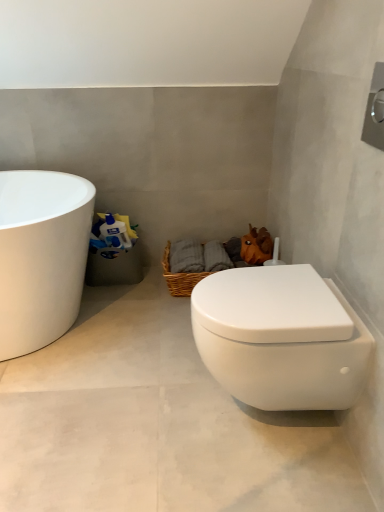
Question: Is white glossy toilet at lower right next to white matte toilet at lower right and touching it?

Choices:
 (A) yes
 (B) no

Answer: (B)

Question: Considering the relative sizes of white glossy toilet at lower right and white matte toilet at lower right in the image provided, is white glossy toilet at lower right thinner than white matte toilet at lower right?

Choices:
 (A) yes
 (B) no

Answer: (A)

Question: Does white glossy toilet at lower right have a greater width compared to white matte toilet at lower right?

Choices:
 (A) no
 (B) yes

Answer: (A)

Question: Does white glossy toilet at lower right have a lesser height compared to white matte toilet at lower right?

Choices:
 (A) no
 (B) yes

Answer: (A)

Question: Could you tell me if white glossy toilet at lower right is facing white matte toilet at lower right?

Choices:
 (A) no
 (B) yes

Answer: (A)

Question: Is white glossy toilet at lower right wider or thinner than white matte toilet at lower right?

Choices:
 (A) wide
 (B) thin

Answer: (B)

Question: Considering the positions of white glossy toilet at lower right and white matte toilet at lower right in the image, is white glossy toilet at lower right bigger or smaller than white matte toilet at lower right?

Choices:
 (A) big
 (B) small

Answer: (B)

Question: From a real-world perspective, is white glossy toilet at lower right positioned above or below white matte toilet at lower right?

Choices:
 (A) below
 (B) above

Answer: (B)

Question: In the image, is white glossy toilet at lower right on the left side or the right side of white matte toilet at lower right?

Choices:
 (A) right
 (B) left

Answer: (A)

Question: From the image's perspective, relative to orange matte plush toy at upper right, is white glossy toilet at lower right above or below?

Choices:
 (A) below
 (B) above

Answer: (A)

Question: In the image, is white glossy toilet at lower right on the left side or the right side of orange matte plush toy at upper right?

Choices:
 (A) right
 (B) left

Answer: (B)

Question: Looking at their shapes, would you say white glossy toilet at lower right is wider or thinner than orange matte plush toy at upper right?

Choices:
 (A) wide
 (B) thin

Answer: (A)

Question: Is white glossy toilet at lower right taller or shorter than orange matte plush toy at upper right?

Choices:
 (A) short
 (B) tall

Answer: (B)

Question: From their relative heights in the image, would you say white matte toilet at lower right is taller or shorter than orange matte plush toy at upper right?

Choices:
 (A) tall
 (B) short

Answer: (B)

Question: Based on their positions, is white matte toilet at lower right located to the left or right of orange matte plush toy at upper right?

Choices:
 (A) right
 (B) left

Answer: (B)